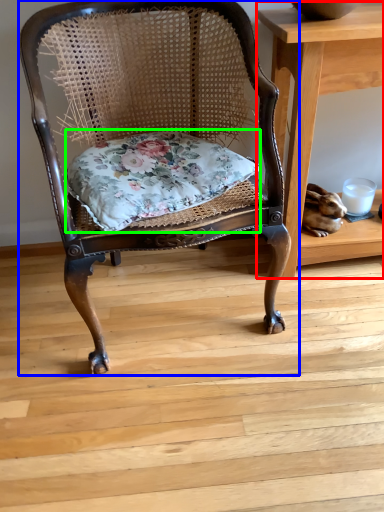
Question: Based on their relative distances, which object is farther from table (highlighted by a red box)? Choose from chair (highlighted by a blue box) and pillow (highlighted by a green box).

Choices:
 (A) chair
 (B) pillow

Answer: (B)